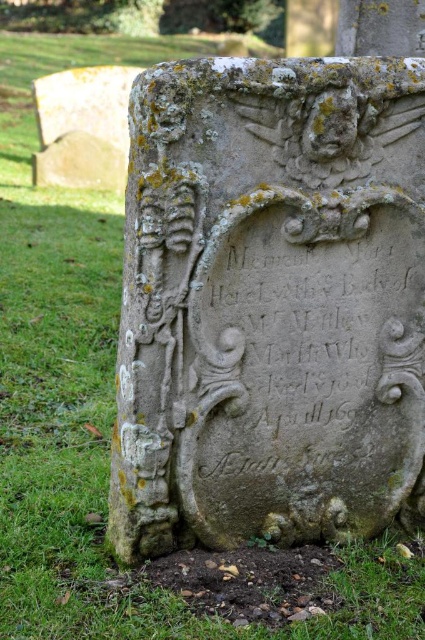
Is carved stone gravestone at center positioned behind carved stone inscription at center?

No, carved stone gravestone at center is closer to the viewer.

Is carved stone gravestone at center bigger than carved stone inscription at center?

Yes.

Where is `carved stone gravestone at center`? carved stone gravestone at center is located at coordinates (269, 301).

Locate an element on the screen. This screenshot has height=640, width=425. carved stone gravestone at center is located at coordinates pos(269,301).